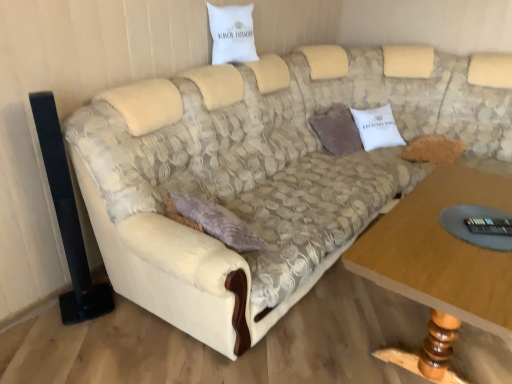
The image size is (512, 384). What do you see at coordinates (433, 149) in the screenshot?
I see `fuzzy brown pillow at right, acting as the first pillow starting from the right` at bounding box center [433, 149].

This screenshot has width=512, height=384. What do you see at coordinates (441, 251) in the screenshot?
I see `wooden table at lower right` at bounding box center [441, 251].

Locate an element on the screen. This screenshot has height=384, width=512. transparent glass remote control at lower right is located at coordinates (468, 228).

Considering the sizes of white fabric pillow at upper center, the second pillow from the right, and transparent glass remote control at lower right in the image, is white fabric pillow at upper center, the second pillow from the right, wider or thinner than transparent glass remote control at lower right?

Clearly, white fabric pillow at upper center, the second pillow from the right, has less width compared to transparent glass remote control at lower right.

In the scene shown: Is white fabric pillow at upper center, the second pillow when ordered from back to front, outside of transparent glass remote control at lower right?

Yes, white fabric pillow at upper center, the second pillow when ordered from back to front, is not within transparent glass remote control at lower right.

Considering the relative positions of white fabric pillow at upper center, the second pillow when ordered from back to front, and transparent glass remote control at lower right in the image provided, is white fabric pillow at upper center, the second pillow when ordered from back to front, behind transparent glass remote control at lower right?

Yes, white fabric pillow at upper center, the second pillow when ordered from back to front, is behind transparent glass remote control at lower right.

Which object is wider, beige fabric couch at center or transparent glass remote control at lower right?

beige fabric couch at center is wider.

Does beige fabric couch at center lie behind transparent glass remote control at lower right?

No, it is in front of transparent glass remote control at lower right.

Considering the positions of point (121, 93) and point (475, 216), is point (121, 93) closer or farther from the camera than point (475, 216)?

Point (121, 93) is positioned farther from the camera compared to point (475, 216).

Is beige fabric couch at center completely or partially outside of transparent glass remote control at lower right?

Yes.

Which of these two, wooden table at lower right or transparent glass remote control at lower right, is smaller?

With smaller size is transparent glass remote control at lower right.

Which of these two, wooden table at lower right or transparent glass remote control at lower right, stands shorter?

With less height is transparent glass remote control at lower right.

Which object is positioned more to the left, wooden table at lower right or transparent glass remote control at lower right?

wooden table at lower right.

How far apart are wooden table at lower right and transparent glass remote control at lower right?

A distance of 7.70 inches exists between wooden table at lower right and transparent glass remote control at lower right.

From the image's perspective, between fuzzy brown pillow at right, placed as the first pillow when sorted from bottom to top, and transparent glass remote control at lower right, which one is located above?

fuzzy brown pillow at right, placed as the first pillow when sorted from bottom to top.

I want to click on glass table below the fuzzy brown pillow at right, placed as the first pillow when sorted from bottom to top (from the image's perspective), so click(x=468, y=228).

Which of these two, fuzzy brown pillow at right, placed as the first pillow when sorted from bottom to top, or transparent glass remote control at lower right, is thinner?

transparent glass remote control at lower right.

Which point is more distant from viewer, (448,145) or (479,213)?

The point (448,145) is farther from the camera.

From a real-world perspective, is transparent glass remote control at lower right positioned above or below wooden table at lower right?

Clearly, from a real-world perspective, transparent glass remote control at lower right is above wooden table at lower right.

Measure the distance from transparent glass remote control at lower right to wooden table at lower right.

transparent glass remote control at lower right is 7.70 inches from wooden table at lower right.

Is transparent glass remote control at lower right closer to camera compared to wooden table at lower right?

That is False.

Considering the positions of objects transparent glass remote control at lower right and wooden table at lower right in the image provided, who is more to the right, transparent glass remote control at lower right or wooden table at lower right?

transparent glass remote control at lower right is more to the right.

From the picture: Considering the relative sizes of fuzzy brown pillow at right, the 1th pillow from the back, and beige fabric couch at center in the image provided, is fuzzy brown pillow at right, the 1th pillow from the back, wider than beige fabric couch at center?

No.

From a real-world perspective, who is located higher, fuzzy brown pillow at right, the 2th pillow in the front-to-back sequence, or beige fabric couch at center?

beige fabric couch at center, from a real-world perspective.

Which is behind, point (429, 161) or point (447, 54)?

The point (447, 54) is farther.

Is fuzzy brown pillow at right, the 1th pillow from the back, far away from beige fabric couch at center?

No, fuzzy brown pillow at right, the 1th pillow from the back, is not far from beige fabric couch at center.

Does point (234, 33) appear closer or farther from the camera than point (224, 203)?

Point (234, 33) is farther from the camera than point (224, 203).

From a real-world perspective, who is located higher, white fabric pillow at upper center, marked as the second pillow in a bottom-to-top arrangement, or beige fabric couch at center?

white fabric pillow at upper center, marked as the second pillow in a bottom-to-top arrangement, is physically above.

Identify the location of studio couch on the right side of white fabric pillow at upper center, which is the 1th pillow in top-to-bottom order. The image size is (512, 384). (266, 172).

Is beige fabric couch at center at the back of white fabric pillow at upper center, which is the 1th pillow in top-to-bottom order?

No, white fabric pillow at upper center, which is the 1th pillow in top-to-bottom order, is not facing away from beige fabric couch at center.

Find the location of `the 2nd pillow above the transparent glass remote control at lower right (from the image's perspective)`. the 2nd pillow above the transparent glass remote control at lower right (from the image's perspective) is located at coordinates (232, 34).

Where is `glass table below the beige fabric couch at center (from the image's perspective)`? This screenshot has height=384, width=512. glass table below the beige fabric couch at center (from the image's perspective) is located at coordinates (468, 228).

Estimate the real-world distances between objects in this image. Which object is closer to beige fabric couch at center, transparent glass remote control at lower right or white fabric pillow at upper center, which is the 1th pillow in top-to-bottom order?

white fabric pillow at upper center, which is the 1th pillow in top-to-bottom order, lies closer to beige fabric couch at center than the other object.

Based on their spatial positions, is wooden table at lower right or transparent glass remote control at lower right further from fuzzy brown pillow at right, the 2th pillow in the left-to-right sequence?

Based on the image, transparent glass remote control at lower right appears to be further to fuzzy brown pillow at right, the 2th pillow in the left-to-right sequence.

Consider the image. Estimate the real-world distances between objects in this image. Which object is further from fuzzy brown pillow at right, the 2th pillow in the left-to-right sequence, wooden table at lower right or white fabric pillow at upper center, which is the 1th pillow in top-to-bottom order?

The object further to fuzzy brown pillow at right, the 2th pillow in the left-to-right sequence, is white fabric pillow at upper center, which is the 1th pillow in top-to-bottom order.

Looking at the image, which one is located further to white fabric pillow at upper center, which is the 1th pillow in top-to-bottom order, transparent glass remote control at lower right or wooden table at lower right?

Based on the image, transparent glass remote control at lower right appears to be further to white fabric pillow at upper center, which is the 1th pillow in top-to-bottom order.

Looking at the image, which one is located closer to transparent glass remote control at lower right, fuzzy brown pillow at right, the 2th pillow in the left-to-right sequence, or wooden table at lower right?

wooden table at lower right is closer to transparent glass remote control at lower right.

In the scene shown: When comparing their distances from wooden table at lower right, does fuzzy brown pillow at right, acting as the first pillow starting from the right, or transparent glass remote control at lower right seem closer?

transparent glass remote control at lower right is positioned closer to the anchor wooden table at lower right.

Looking at the image, which one is located further to fuzzy brown pillow at right, the second pillow viewed from the top, transparent glass remote control at lower right or wooden table at lower right?

The object further to fuzzy brown pillow at right, the second pillow viewed from the top, is transparent glass remote control at lower right.

Based on their spatial positions, is fuzzy brown pillow at right, the 2th pillow in the left-to-right sequence, or white fabric pillow at upper center, the second pillow from the right, further from wooden table at lower right?

white fabric pillow at upper center, the second pillow from the right, is further to wooden table at lower right.

Locate an element on the screen. The image size is (512, 384). pillow between beige fabric couch at center and fuzzy brown pillow at right, placed as the first pillow when sorted from bottom to top, from front to back is located at coordinates (232, 34).

I want to click on glass table positioned between wooden table at lower right and fuzzy brown pillow at right, the second pillow viewed from the top, from near to far, so click(x=468, y=228).

This screenshot has width=512, height=384. I want to click on glass table between white fabric pillow at upper center, which is the 1th pillow in top-to-bottom order, and fuzzy brown pillow at right, placed as the first pillow when sorted from bottom to top, in the horizontal direction, so click(x=468, y=228).

In order to click on glass table between white fabric pillow at upper center, marked as the second pillow in a bottom-to-top arrangement, and wooden table at lower right from top to bottom in this screenshot , I will do `click(468, 228)`.